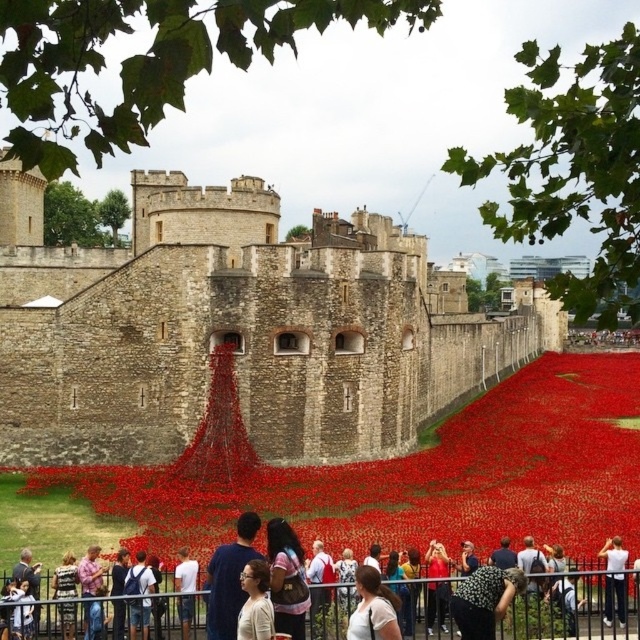
You are a tourist visiting the Tower of London and want to take a photo of the white cotton shirt at lower center with the matte red poppy field at center in the background. Will the poppy field be visible behind the shirt in the photo?

The matte red poppy field at center is taller than the white cotton shirt at lower center, so yes, the poppy field will be visible behind the shirt in the photo.

You are a tourist standing in front of the Tower of London. You see a metallic silver fence at lower center and a white cotton shirt at lower right. Which object is closer to your left side?

The metallic silver fence at lower center is closer to your left side because it is positioned to the left of the white cotton shirt at lower right.